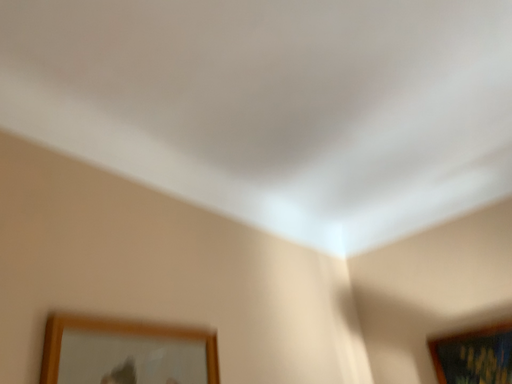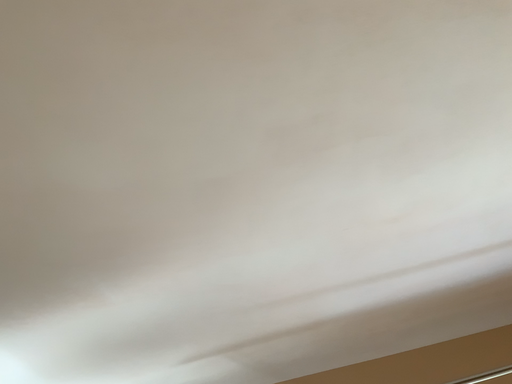
Question: Which way did the camera rotate in the video?

Choices:
 (A) rotated right
 (B) rotated left

Answer: (A)